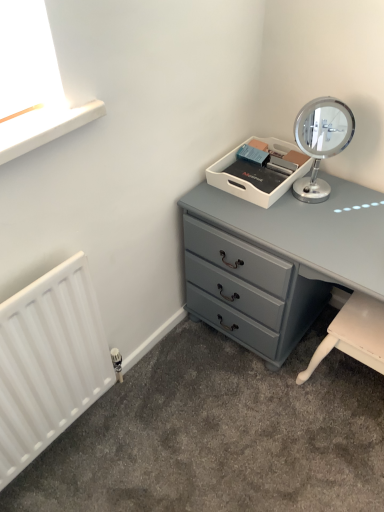
I want to click on free space in front of white plastic tray at upper center, so click(287, 219).